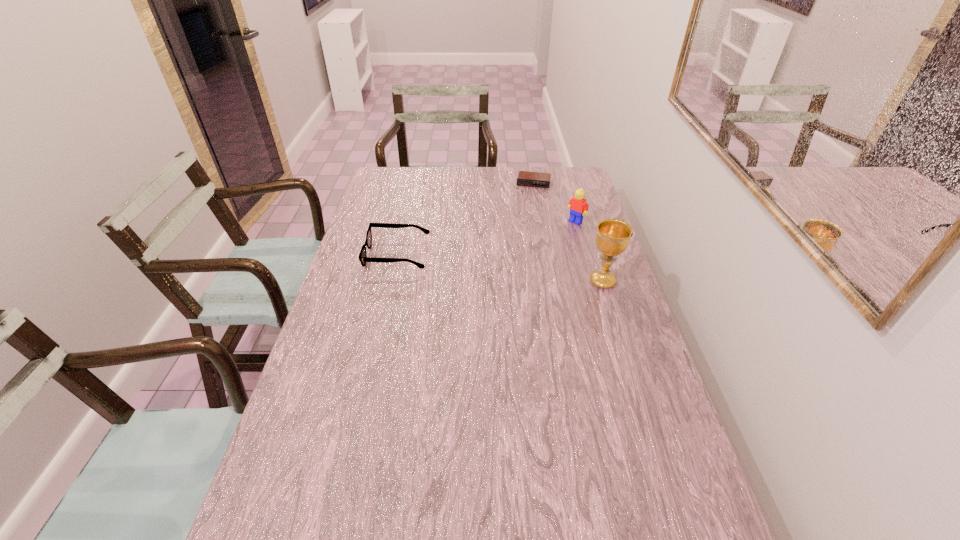
Where is `vacant point located between the Lego and the tallest object`? vacant point located between the Lego and the tallest object is located at coordinates (589, 252).

Where is `vacant point located between the third nearest object and the chalice`? The image size is (960, 540). vacant point located between the third nearest object and the chalice is located at coordinates (589, 252).

The height and width of the screenshot is (540, 960). What are the coordinates of `vacant space that is in between the spectacles and the Lego` in the screenshot? It's located at (487, 238).

The height and width of the screenshot is (540, 960). Find the location of `vacant area between the chalice and the Lego`. vacant area between the chalice and the Lego is located at coordinates (589, 252).

Find the location of a particular element. This screenshot has width=960, height=540. free space that is in between the spectacles and the second farthest object is located at coordinates (487, 238).

In order to click on empty location between the third tallest object and the tallest object in this screenshot , I will do `click(500, 268)`.

The width and height of the screenshot is (960, 540). Find the location of `vacant point located between the chalice and the spectacles`. vacant point located between the chalice and the spectacles is located at coordinates (500, 268).

The height and width of the screenshot is (540, 960). What are the coordinates of `object that is the second closest to the third object from right to left` in the screenshot? It's located at (363, 258).

At what (x,y) coordinates should I click in order to perform the action: click on object that is the third closest to the second object from left to right. Please return your answer as a coordinate pair (x, y). The width and height of the screenshot is (960, 540). Looking at the image, I should click on (612, 238).